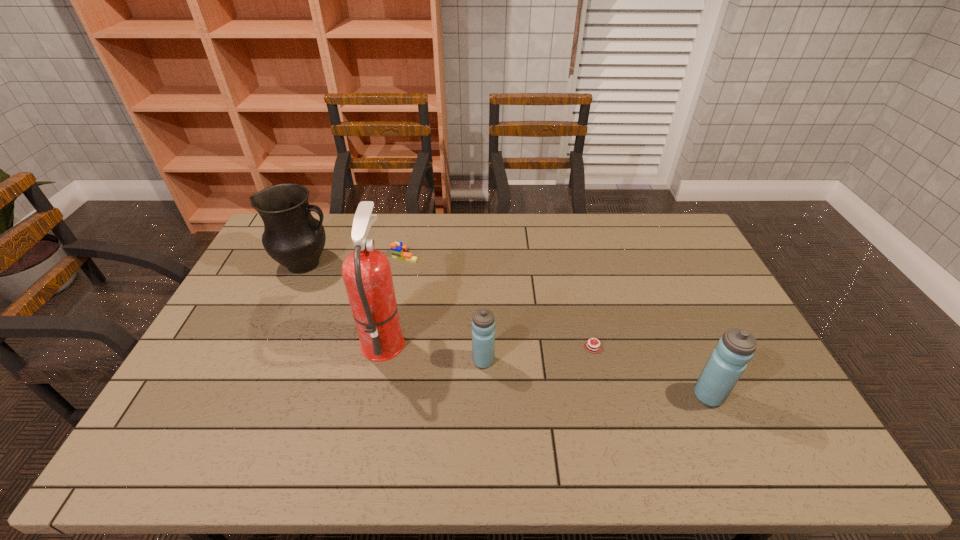
All water bottles are currently evenly spaced. To continue this pattern, where would you add another water bottle on the left? Please point out a vacant spot. Please provide its 2D coordinates. Your answer should be formatted as a tuple, i.e. [(x, y)], where the tuple contains the x and y coordinates of a point satisfying the conditions above.

[(287, 330)]